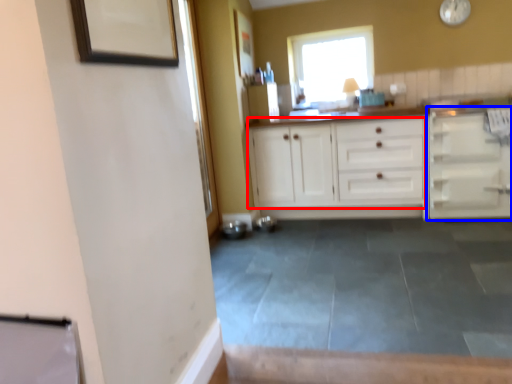
Question: Which object appears closest to the camera in this image, cabinetry (highlighted by a red box) or cabinetry (highlighted by a blue box)?

Choices:
 (A) cabinetry
 (B) cabinetry

Answer: (B)